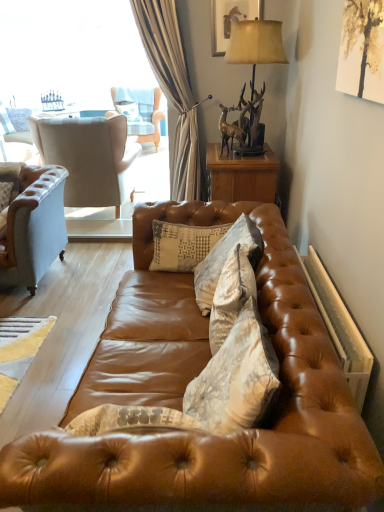
Question: Choose the correct answer: Is textured beige pillow at center, the 3th pillow viewed from the left, inside shiny brown leather couch at center or outside it?

Choices:
 (A) outside
 (B) inside

Answer: (B)

Question: Is point (226, 274) closer or farther from the camera than point (246, 457)?

Choices:
 (A) closer
 (B) farther

Answer: (B)

Question: Considering the real-world distances, which object is farthest from the metallic gold deer at upper right?

Choices:
 (A) shiny brown leather couch at center
 (B) wooden nightstand at center
 (C) wooden picture frame at upper center
 (D) white textured pillow at center, which ranks as the 1th pillow in left-to-right order
 (E) light blue fabric chair at upper left, which appears as the 2th chair when ordered from the bottom

Answer: (D)

Question: Which of these objects is positioned closest to the light beige fabric wingback chair at left, the first chair viewed from the front?

Choices:
 (A) shiny brown leather couch at center
 (B) wooden picture frame at upper center
 (C) textured beige pillow at center, marked as the 3th pillow in a back-to-front arrangement
 (D) light blue fabric chair at upper left, which ranks as the second chair in front-to-back order
 (E) metallic gold deer at upper right

Answer: (D)